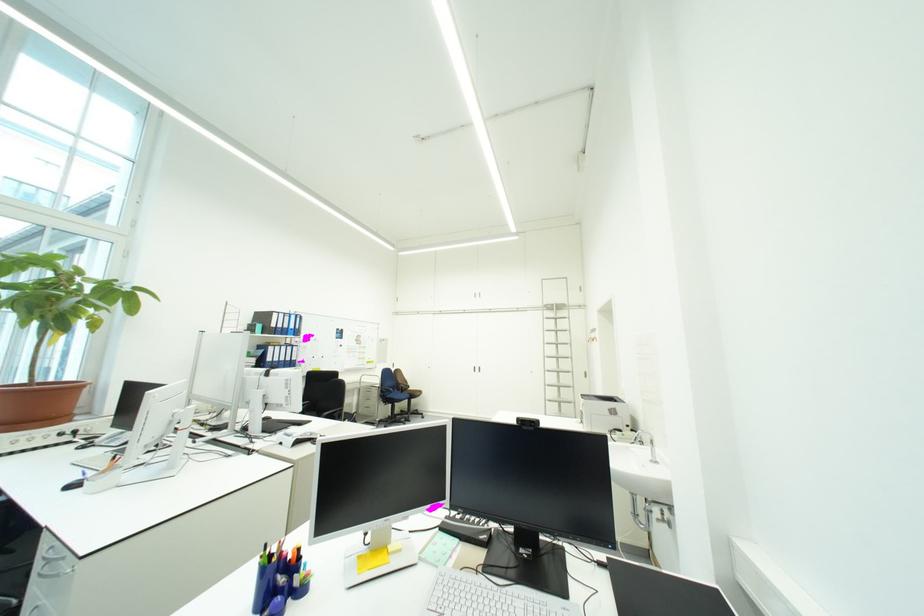
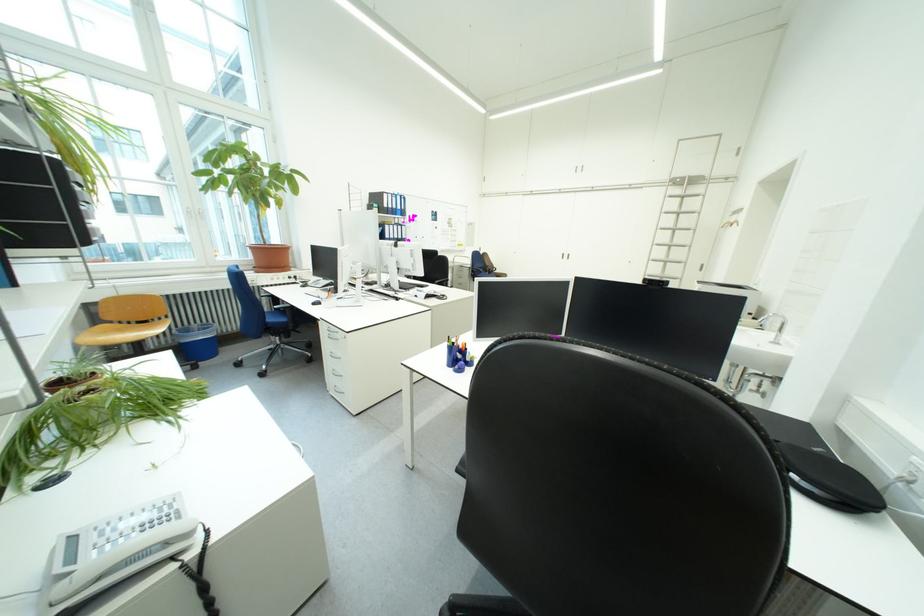
Where in the second image is the point corresponding to point (658, 450) from the first image?

(780, 336)